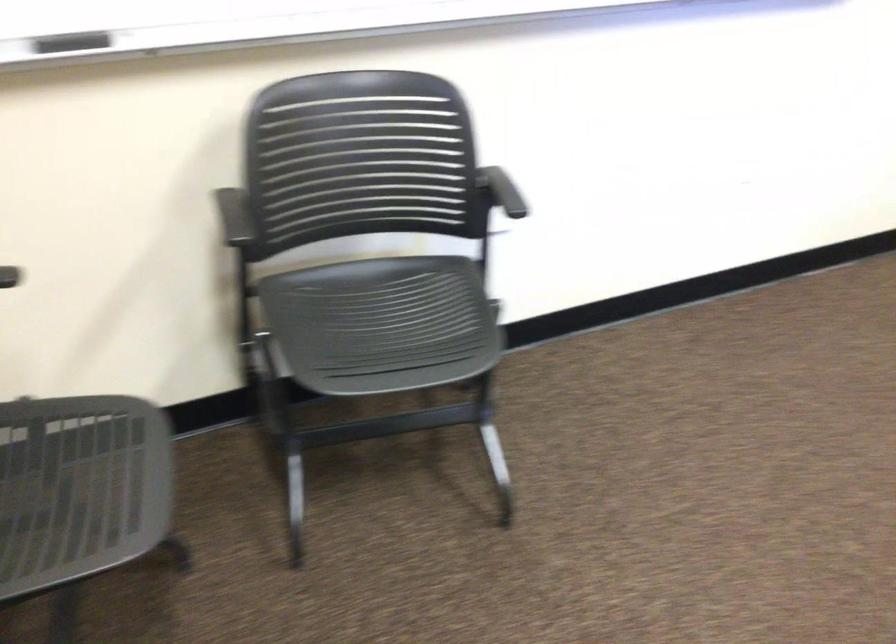
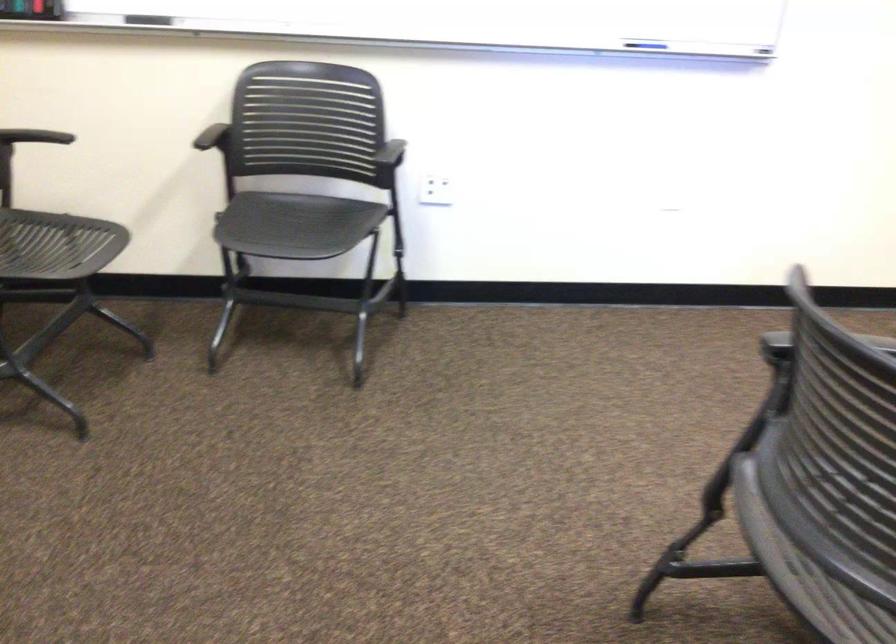
Locate, in the second image, the point that corresponds to point 358,317 in the first image.

(295, 225)